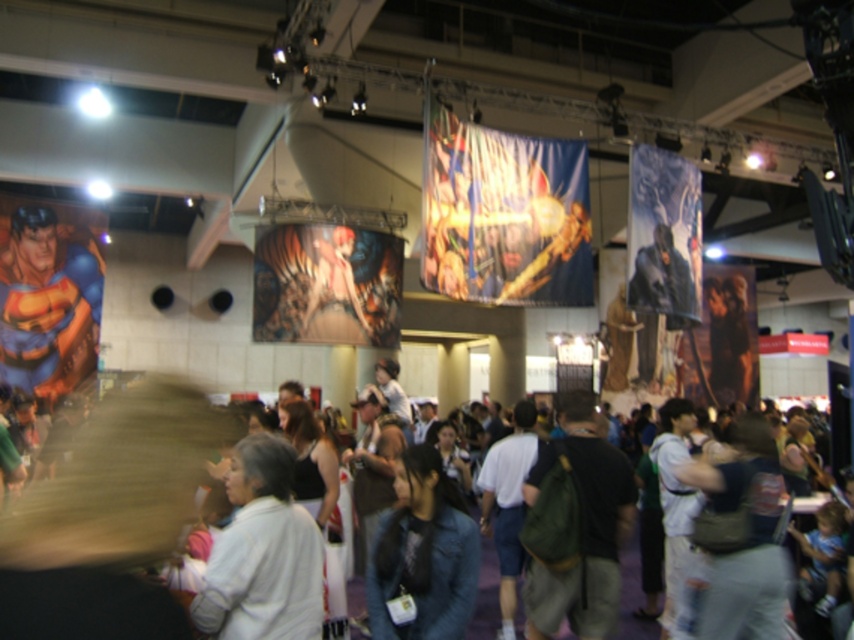
Can you confirm if white fabric at center is shorter than denim jacket at center?

Yes.

Between point (268, 472) and point (404, 486), which one is positioned in front?

Point (268, 472)

Who is more distant from viewer, (214, 570) or (451, 572)?

Positioned behind is point (451, 572).

The image size is (854, 640). I want to click on white fabric at center, so click(262, 552).

Is white fabric at center positioned at the back of matte blue suit at left?

No.

Can you confirm if white fabric at center is shorter than matte blue suit at left?

Yes, white fabric at center is shorter than matte blue suit at left.

The width and height of the screenshot is (854, 640). In order to click on white fabric at center in this screenshot , I will do `click(262, 552)`.

Find the location of a particular element. white fabric at center is located at coordinates (262, 552).

Can you confirm if white cotton shirt at center is taller than denim jacket at center?

In fact, white cotton shirt at center may be shorter than denim jacket at center.

This screenshot has width=854, height=640. I want to click on white cotton shirt at center, so click(x=109, y=516).

Where is `white cotton shirt at center`? white cotton shirt at center is located at coordinates (109, 516).